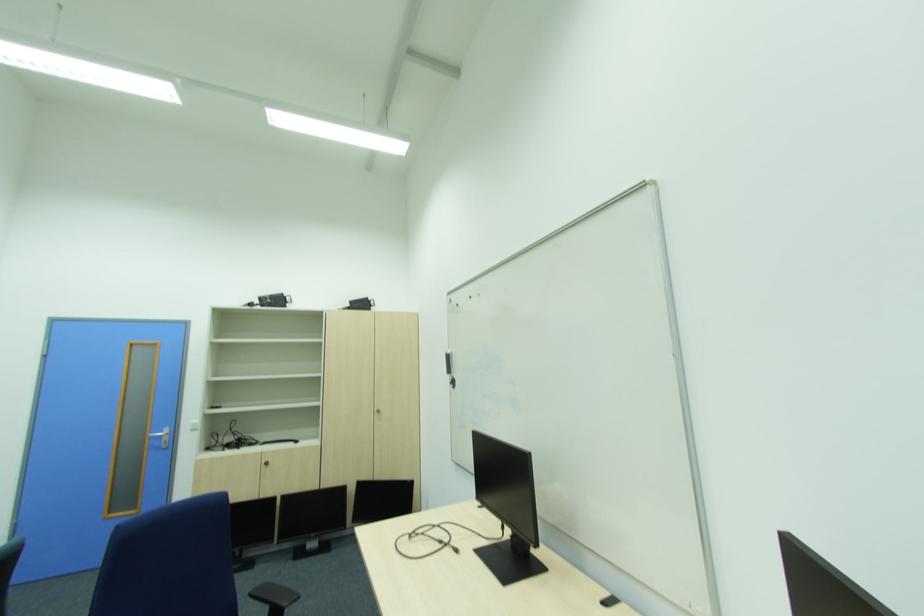
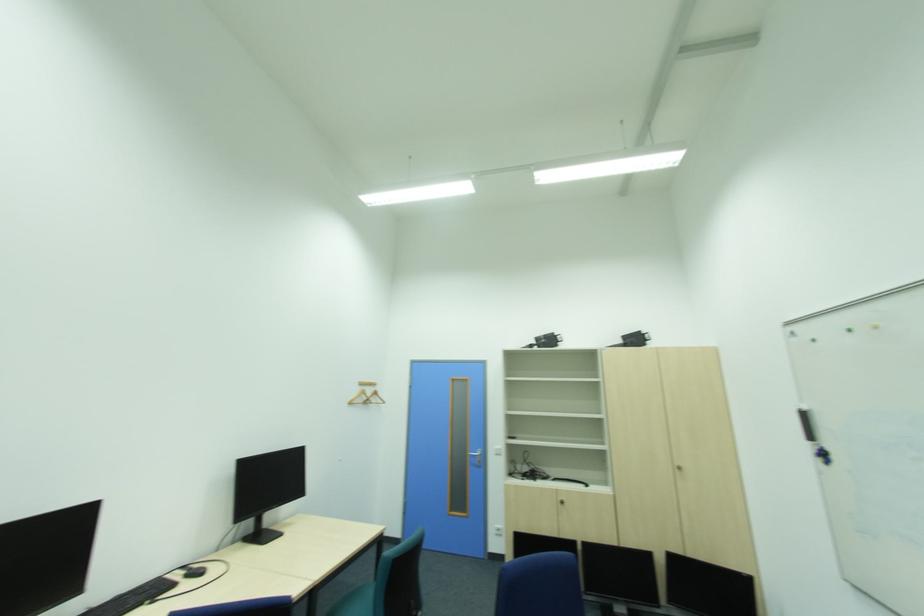
Question: How did the camera likely rotate?

Choices:
 (A) Left
 (B) Right
 (C) Up
 (D) Down

Answer: (A)